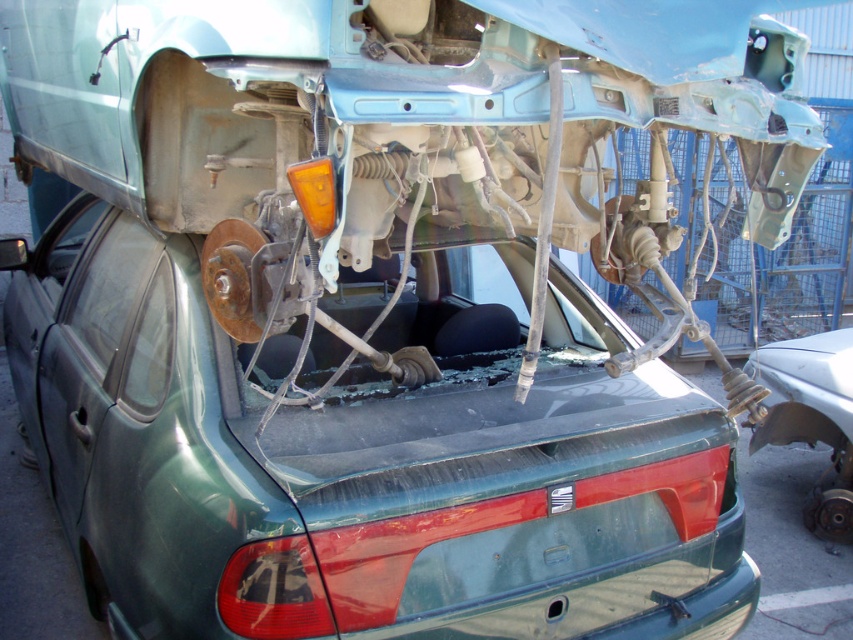
Does transparent glass windshield at center have a greater height compared to rusty metal brake disc at lower right?

Incorrect, transparent glass windshield at center's height is not larger of rusty metal brake disc at lower right's.

Does transparent glass windshield at center have a lesser width compared to rusty metal brake disc at lower right?

No.

Who is more forward, (x=396, y=308) or (x=845, y=525)?

Point (x=396, y=308)

The height and width of the screenshot is (640, 853). Find the location of `transparent glass windshield at center`. transparent glass windshield at center is located at coordinates (463, 301).

Between green matte car at center and rusty metal brake disc at lower right, which one has less height?

rusty metal brake disc at lower right is shorter.

Between green matte car at center and rusty metal brake disc at lower right, which one has more height?

green matte car at center is taller.

This screenshot has width=853, height=640. What do you see at coordinates (368, 460) in the screenshot? I see `green matte car at center` at bounding box center [368, 460].

Locate an element on the screen. Image resolution: width=853 pixels, height=640 pixels. green matte car at center is located at coordinates (368, 460).

Is green matte car at center bigger than transparent glass windshield at center?

Yes.

Is green matte car at center to the right of transparent glass windshield at center from the viewer's perspective?

Incorrect, green matte car at center is not on the right side of transparent glass windshield at center.

At what (x,y) coordinates should I click in order to perform the action: click on green matte car at center. Please return your answer as a coordinate pair (x, y). This screenshot has width=853, height=640. Looking at the image, I should click on (368, 460).